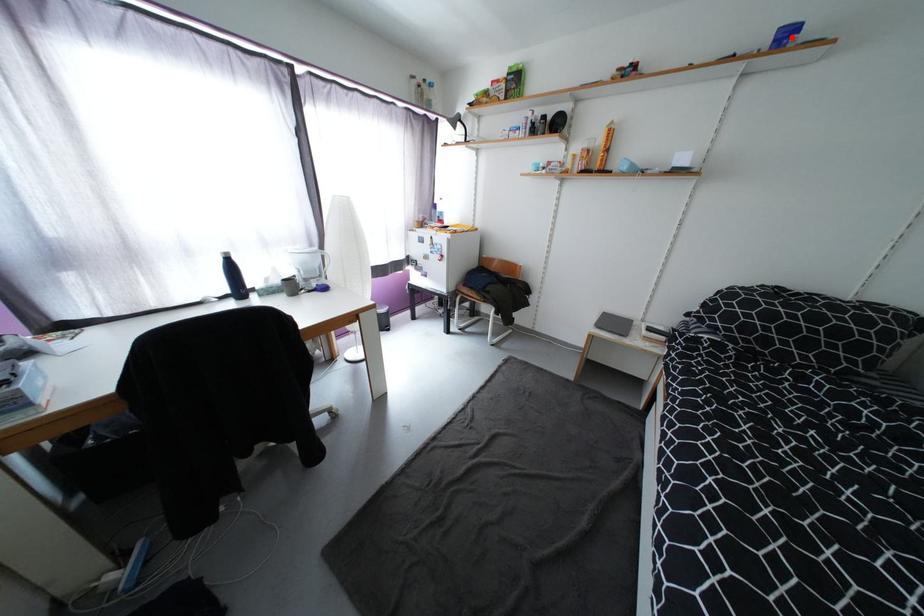
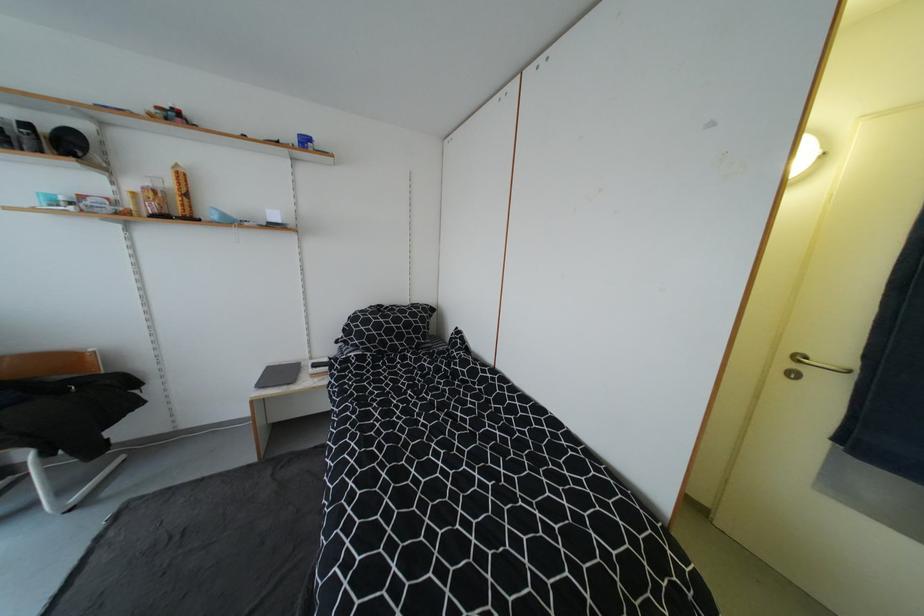
Where in the second image is the point corresponding to the highlighted location from the first image?

(311, 143)